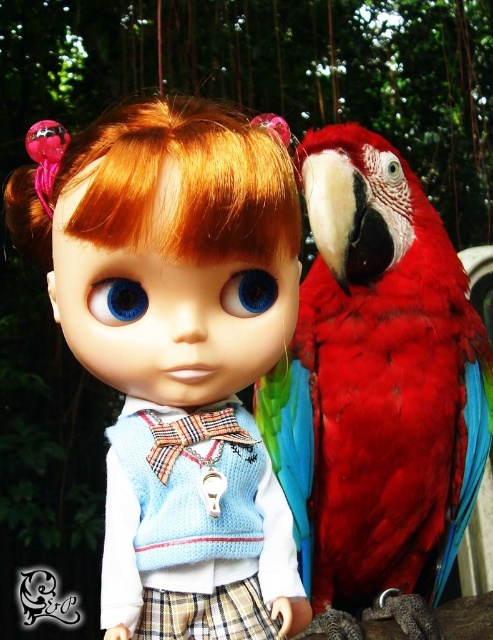
How far apart are matte blue knitted vest at center and shiny red parrot at right?

They are 31.10 centimeters apart.

Who is shorter, matte blue knitted vest at center or shiny red parrot at right?

matte blue knitted vest at center

Identify the location of matte blue knitted vest at center. The height and width of the screenshot is (640, 493). (176, 353).